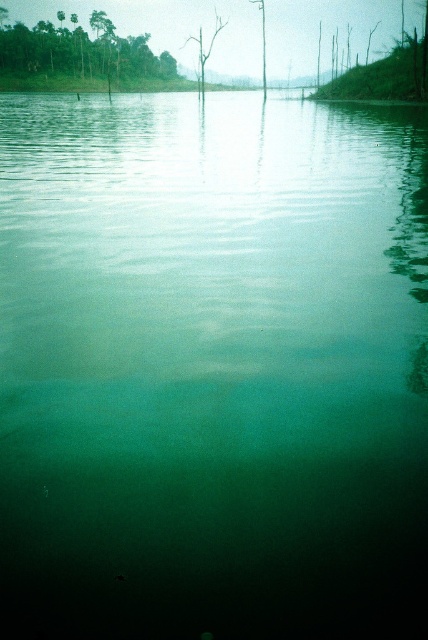
Between green leafy trees at upper left and brown wood tree at center, which one has less height?

green leafy trees at upper left is shorter.

Who is more distant from viewer, [106,20] or [202,52]?

Positioned behind is point [106,20].

The height and width of the screenshot is (640, 428). In order to click on green leafy trees at upper left in this screenshot , I will do `click(80, 51)`.

Where is `green leafy trees at upper left`? green leafy trees at upper left is located at coordinates (80, 51).